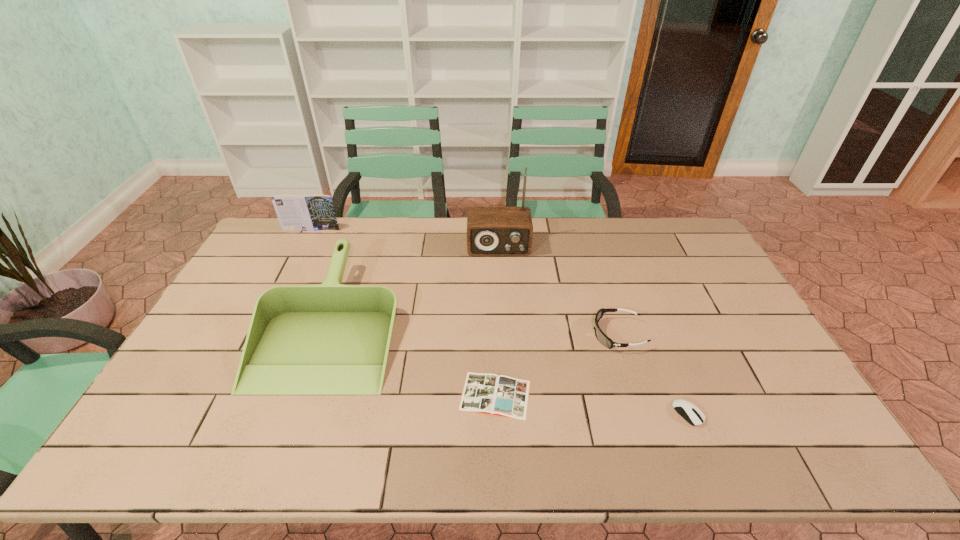
Identify which object is the fifth nearest to the goggles. Please provide its 2D coordinates. Your answer should be formatted as a tuple, i.e. [(x, y)], where the tuple contains the x and y coordinates of a point satisfying the conditions above.

[(314, 212)]

This screenshot has width=960, height=540. I want to click on vacant space that satisfies the following two spatial constraints: 1. on the front and sides of the fifth object from left to right; 2. on the right side of the fifth tallest object, so click(x=643, y=413).

At what (x,y) coordinates should I click in order to perform the action: click on vacant region that satisfies the following two spatial constraints: 1. on the front-facing side of the fifth nearest object; 2. on the left side of the fifth tallest object. Please return your answer as a coordinate pair (x, y). Looking at the image, I should click on (508, 413).

This screenshot has height=540, width=960. I want to click on free spot that satisfies the following two spatial constraints: 1. on the front cover of the rightmost object; 2. on the left side of the farther book, so point(220,413).